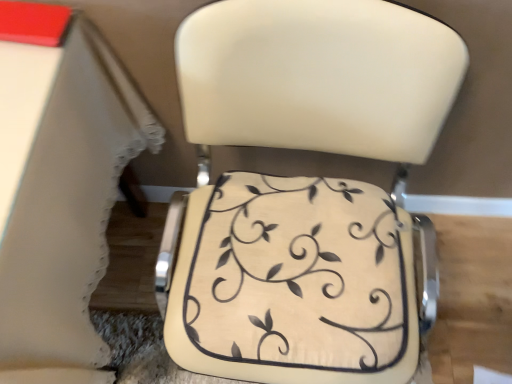
Question: From the image's perspective, would you say white lace tablecloth at lower left is shown under matte cream cushion at center?

Choices:
 (A) yes
 (B) no

Answer: (B)

Question: Is white lace tablecloth at lower left smaller than matte cream cushion at center?

Choices:
 (A) no
 (B) yes

Answer: (A)

Question: Considering the relative sizes of white lace tablecloth at lower left and matte cream cushion at center in the image provided, is white lace tablecloth at lower left bigger than matte cream cushion at center?

Choices:
 (A) no
 (B) yes

Answer: (B)

Question: Is white lace tablecloth at lower left to the right of matte cream cushion at center from the viewer's perspective?

Choices:
 (A) yes
 (B) no

Answer: (B)

Question: From a real-world perspective, is white lace tablecloth at lower left below matte cream cushion at center?

Choices:
 (A) yes
 (B) no

Answer: (A)

Question: Does white lace tablecloth at lower left appear on the left side of matte cream cushion at center?

Choices:
 (A) no
 (B) yes

Answer: (B)

Question: Is beige fabric cushion at center completely or partially inside white lace tablecloth at lower left?

Choices:
 (A) no
 (B) yes

Answer: (A)

Question: From the image's perspective, is white lace tablecloth at lower left located beneath beige fabric cushion at center?

Choices:
 (A) yes
 (B) no

Answer: (B)

Question: Is white lace tablecloth at lower left oriented towards beige fabric cushion at center?

Choices:
 (A) no
 (B) yes

Answer: (A)

Question: From a real-world perspective, does white lace tablecloth at lower left stand above beige fabric cushion at center?

Choices:
 (A) no
 (B) yes

Answer: (A)

Question: Is white lace tablecloth at lower left positioned in front of beige fabric cushion at center?

Choices:
 (A) no
 (B) yes

Answer: (B)

Question: Is white lace tablecloth at lower left wider than beige fabric cushion at center?

Choices:
 (A) yes
 (B) no

Answer: (A)

Question: Is matte cream cushion at center beside white lace tablecloth at lower left?

Choices:
 (A) no
 (B) yes

Answer: (A)